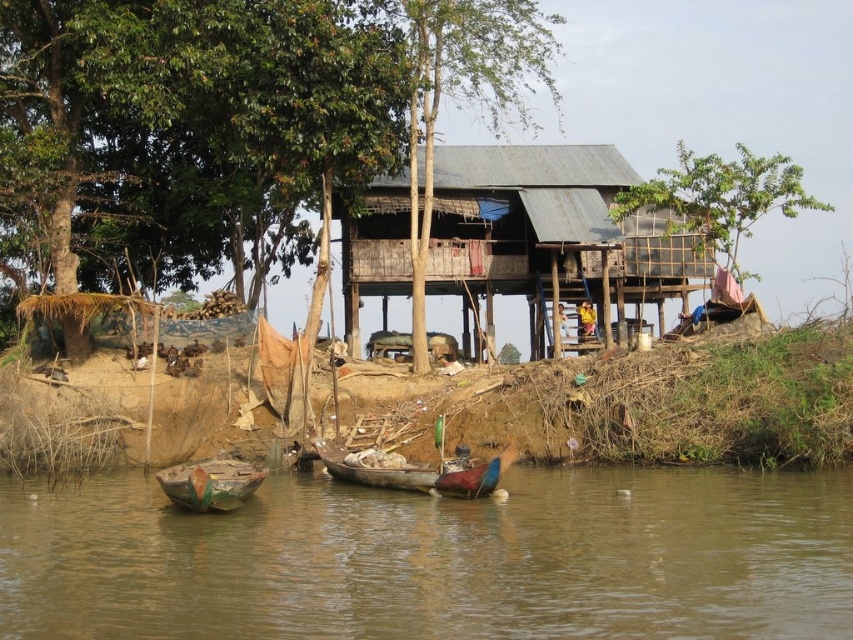
Does rusty corrugated metal hut at center come behind wooden boat at center?

Yes, it is.

Who is positioned more to the left, rusty corrugated metal hut at center or wooden boat at center?

wooden boat at center is more to the left.

Which is behind, point (450, 173) or point (485, 461)?

The point (450, 173) is behind.

Locate an element on the screen. rusty corrugated metal hut at center is located at coordinates (550, 234).

Can you confirm if wooden boat at center is bigger than wooden boat at lower left?

Yes, wooden boat at center is bigger than wooden boat at lower left.

Describe the element at coordinates (415, 474) in the screenshot. Image resolution: width=853 pixels, height=640 pixels. I see `wooden boat at center` at that location.

Image resolution: width=853 pixels, height=640 pixels. Find the location of `wooden boat at center`. wooden boat at center is located at coordinates (415, 474).

Can you confirm if wooden boat at center is positioned to the right of yellow fabric person at center?

In fact, wooden boat at center is to the left of yellow fabric person at center.

Is the position of wooden boat at center less distant than that of yellow fabric person at center?

Yes.

Is point (352, 477) more distant than point (582, 310)?

That is False.

The image size is (853, 640). I want to click on wooden boat at center, so click(415, 474).